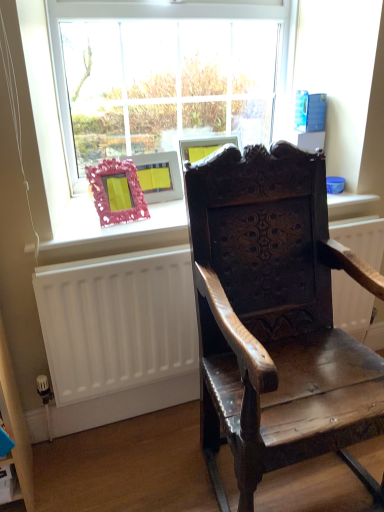
In order to click on vacant region to the left of pink textured frame at window in this screenshot , I will do `click(77, 211)`.